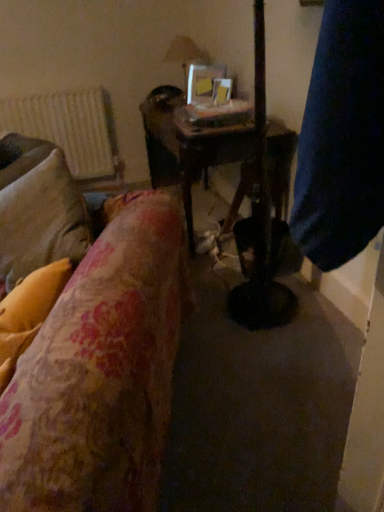
Question: From their relative heights in the image, would you say clear glass lampshade at upper center is taller or shorter than floral fabric pillow at left?

Choices:
 (A) short
 (B) tall

Answer: (B)

Question: Is clear glass lampshade at upper center inside the boundaries of floral fabric pillow at left, or outside?

Choices:
 (A) inside
 (B) outside

Answer: (B)

Question: Which is nearer to the white textured radiator at upper left?

Choices:
 (A) wooden table at center
 (B) clear glass lampshade at upper center
 (C) floral fabric pillow at left

Answer: (B)

Question: Estimate the real-world distances between objects in this image. Which object is closer to the white textured radiator at upper left?

Choices:
 (A) wooden table at center
 (B) clear glass lampshade at upper center
 (C) floral fabric pillow at left

Answer: (B)